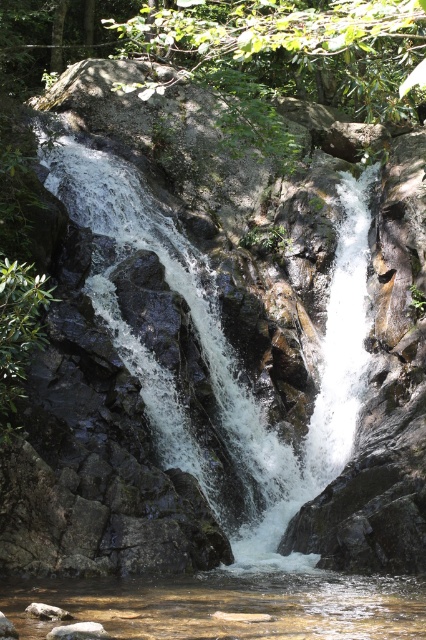
Question: Can you confirm if white frothy water at center is thinner than clear water at bottom center?

Choices:
 (A) no
 (B) yes

Answer: (A)

Question: Among these points, which one is farthest from the camera?

Choices:
 (A) (132, 179)
 (B) (178, 588)

Answer: (A)

Question: Is white frothy water at center wider than clear water at bottom center?

Choices:
 (A) yes
 (B) no

Answer: (A)

Question: Is white frothy water at center positioned behind clear water at bottom center?

Choices:
 (A) yes
 (B) no

Answer: (A)